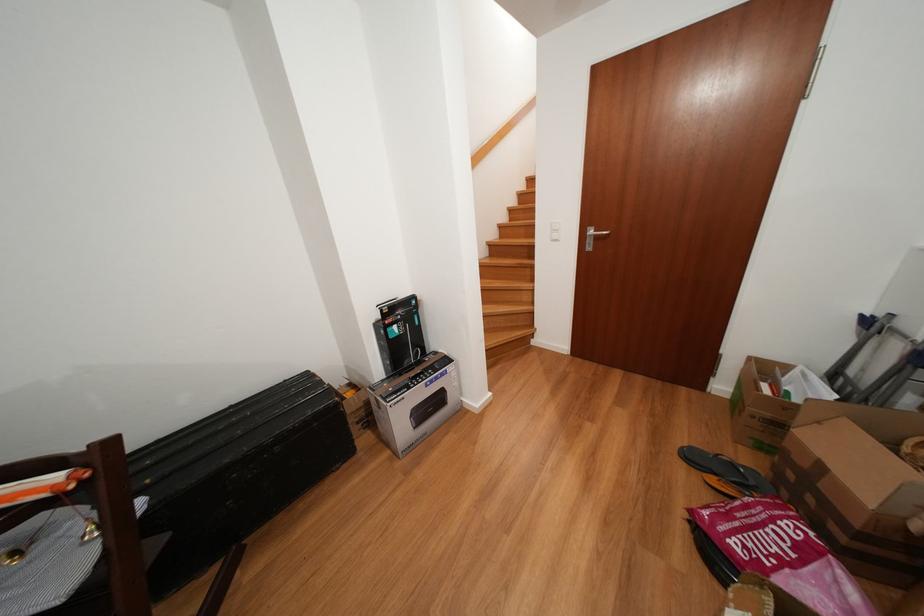
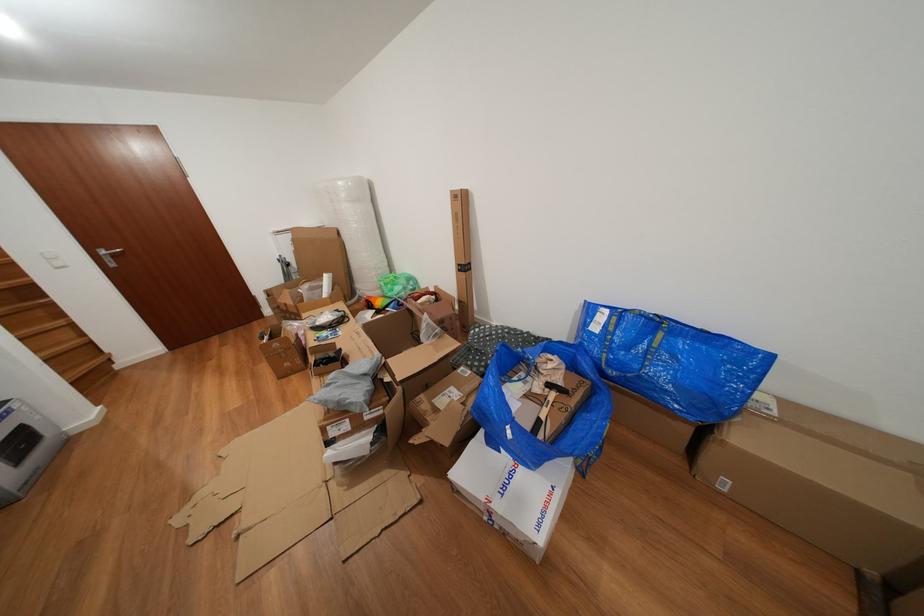
The point at (600, 236) is marked in the first image. Where is the corresponding point in the second image?

(112, 257)